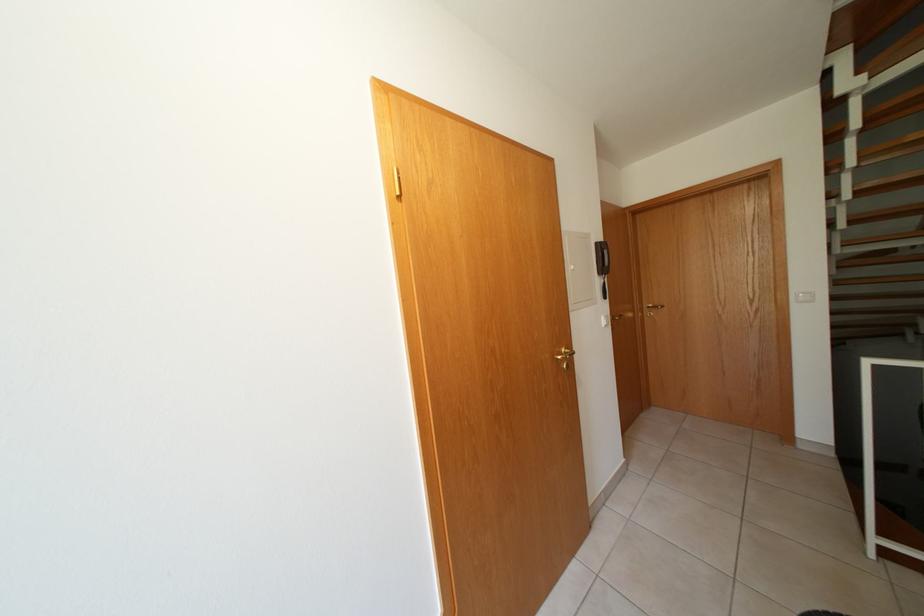
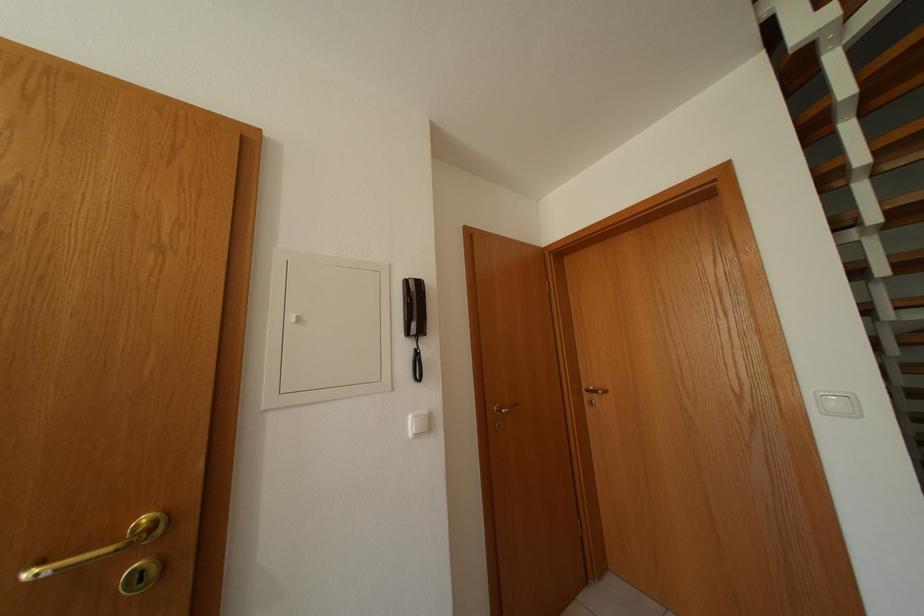
The images are taken continuously from a first-person perspective. In which direction are you moving?

The cameraman moved toward right, forward.